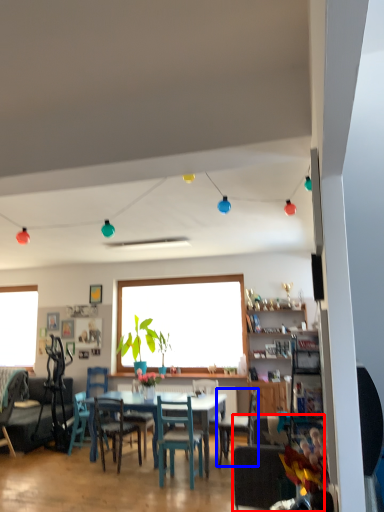
Question: Which point is closer to the camera, chair (highlighted by a red box) or chair (highlighted by a blue box)?

Choices:
 (A) chair
 (B) chair

Answer: (A)